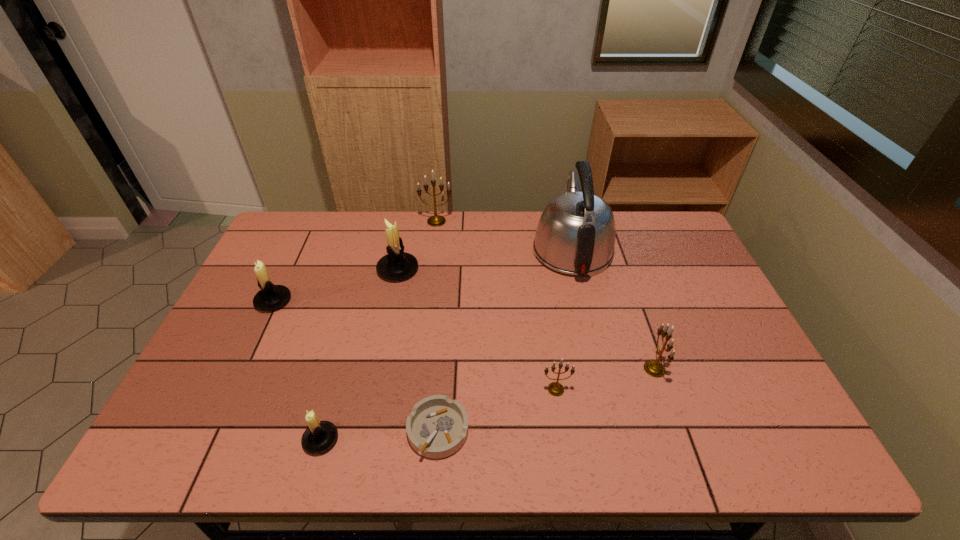
This screenshot has height=540, width=960. Find the location of `free space at the near left corner of the desktop`. free space at the near left corner of the desktop is located at coordinates (228, 433).

Image resolution: width=960 pixels, height=540 pixels. In order to click on vacant space at the far right corner in this screenshot , I will do `click(666, 239)`.

Identify the location of free space between the gray kettle and the nearest white candle holder. The height and width of the screenshot is (540, 960). (446, 345).

You are a GUI agent. You are given a task and a screenshot of the screen. Output one action in this format:
    pyautogui.click(x=<x>, y=<y>)
    Task: Click on the free spot between the leftmost gold candelabrum and the kettle
    
    Given the screenshot: What is the action you would take?
    pyautogui.click(x=504, y=235)

The height and width of the screenshot is (540, 960). Identify the location of vacant space in between the second smallest gold candelabrum and the leftmost candle holder. (464, 335).

Where is `empty space that is in between the second biggest gold candelabrum and the biggest white candle holder`? The width and height of the screenshot is (960, 540). empty space that is in between the second biggest gold candelabrum and the biggest white candle holder is located at coordinates (526, 319).

At what (x,y) coordinates should I click in order to perform the action: click on vacant area that lies between the smallest gold candelabrum and the second biggest white candle holder. Please return your answer as a coordinate pair (x, y). The height and width of the screenshot is (540, 960). Looking at the image, I should click on (415, 345).

Identify the location of vacant area that lies between the gray kettle and the smallest gold candelabrum. This screenshot has height=540, width=960. (564, 320).

Locate an element on the screen. The image size is (960, 540). unoccupied position between the shortest object and the third farthest candle holder is located at coordinates (356, 366).

In order to click on free space that is in between the gray kettle and the shortest object in this screenshot , I will do `click(505, 340)`.